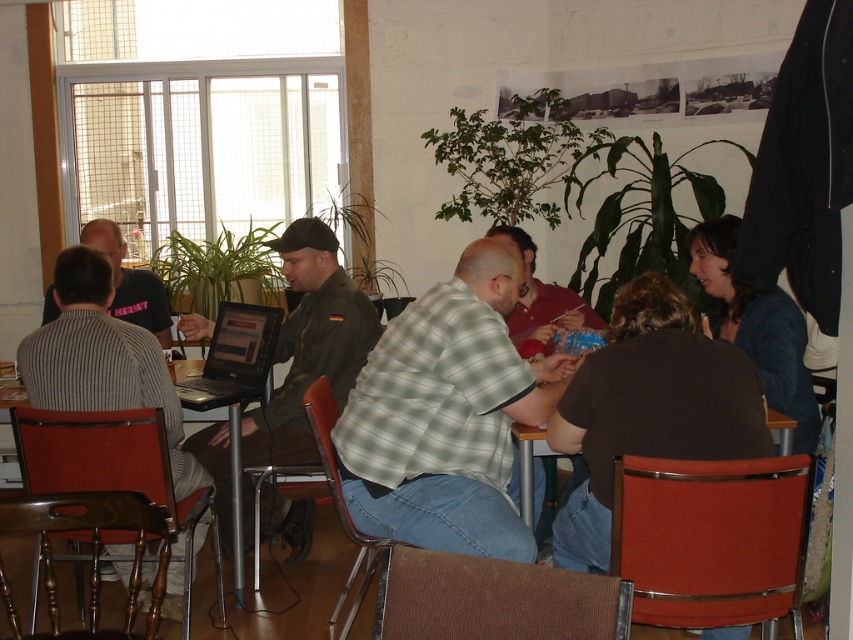
Question: Among these objects, which one is farthest from the camera?

Choices:
 (A) striped knit sweater at left
 (B) green plaid shirt at center
 (C) silver metallic laptop at center

Answer: (A)

Question: Among these points, which one is farthest from the camera?

Choices:
 (A) (515, 368)
 (B) (556, 285)
 (C) (234, 426)
 (D) (169, 342)

Answer: (D)

Question: Where is silver metallic laptop at center located in relation to striped knit sweater at left in the image?

Choices:
 (A) right
 (B) left

Answer: (A)

Question: Which point appears closest to the camera in this image?

Choices:
 (A) (260, 448)
 (B) (567, 316)
 (C) (224, 310)
 (D) (152, 273)

Answer: (A)

Question: Does green plaid shirt at center have a greater width compared to striped knit sweater at left?

Choices:
 (A) yes
 (B) no

Answer: (A)

Question: Is olive green uniform at center wider than silver metallic laptop at center?

Choices:
 (A) yes
 (B) no

Answer: (A)